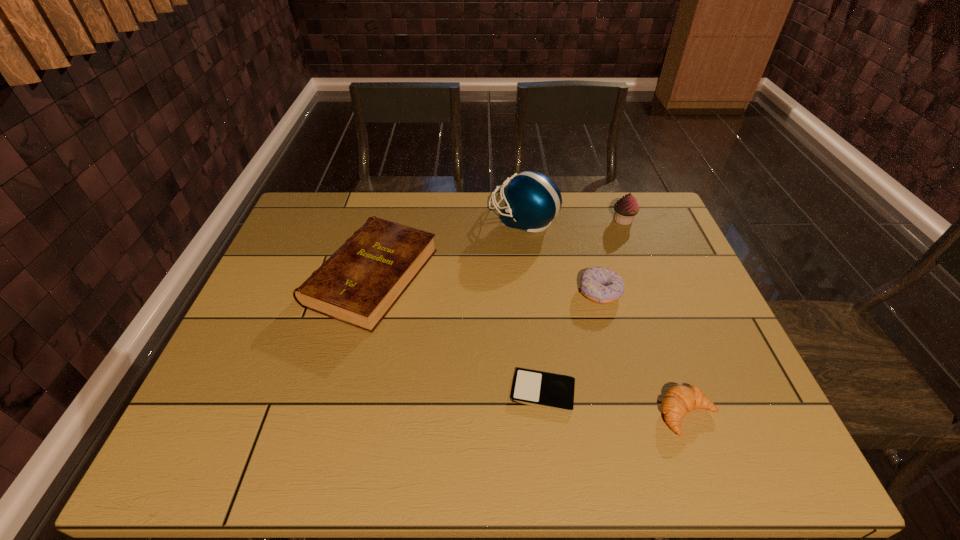
This screenshot has width=960, height=540. Identify the location of free spot at the near right corner of the desktop. (725, 440).

The height and width of the screenshot is (540, 960). What are the coordinates of `free spot between the football helmet and the shortest object` in the screenshot? It's located at (533, 305).

You are a GUI agent. You are given a task and a screenshot of the screen. Output one action in this format:
    pyautogui.click(x=<x>, y=<y>)
    Task: Click on the free spot between the iPod and the hardback book
    
    Given the screenshot: What is the action you would take?
    pyautogui.click(x=457, y=334)

Locate an element on the screen. This screenshot has height=540, width=960. empty space between the crescent roll and the doughnut is located at coordinates (644, 354).

Where is `free space that is in between the crescent roll and the football helmet`? The height and width of the screenshot is (540, 960). free space that is in between the crescent roll and the football helmet is located at coordinates (606, 317).

You are a GUI agent. You are given a task and a screenshot of the screen. Output one action in this format:
    pyautogui.click(x=<x>, y=<y>)
    Task: Click on the unoccupied position between the tallest object and the leftmost object
    
    Given the screenshot: What is the action you would take?
    pyautogui.click(x=447, y=248)

Locate an element on the screen. vacant area that lies between the doughnut and the shortest object is located at coordinates (571, 341).

The height and width of the screenshot is (540, 960). Find the location of `vacant area that lies between the tallest object and the doughnut`. vacant area that lies between the tallest object and the doughnut is located at coordinates (562, 255).

The height and width of the screenshot is (540, 960). What are the coordinates of `vacant point located between the tallest object and the doughnut` in the screenshot? It's located at (562, 255).

Where is `vacant area between the shortest object and the cupcake`? The image size is (960, 540). vacant area between the shortest object and the cupcake is located at coordinates (583, 306).